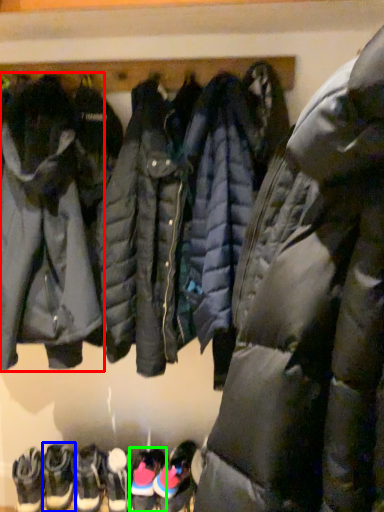
Question: Considering the real-world distances, which object is closest to jacket (highlighted by a red box)? footwear (highlighted by a blue box) or footwear (highlighted by a green box).

Choices:
 (A) footwear
 (B) footwear

Answer: (A)